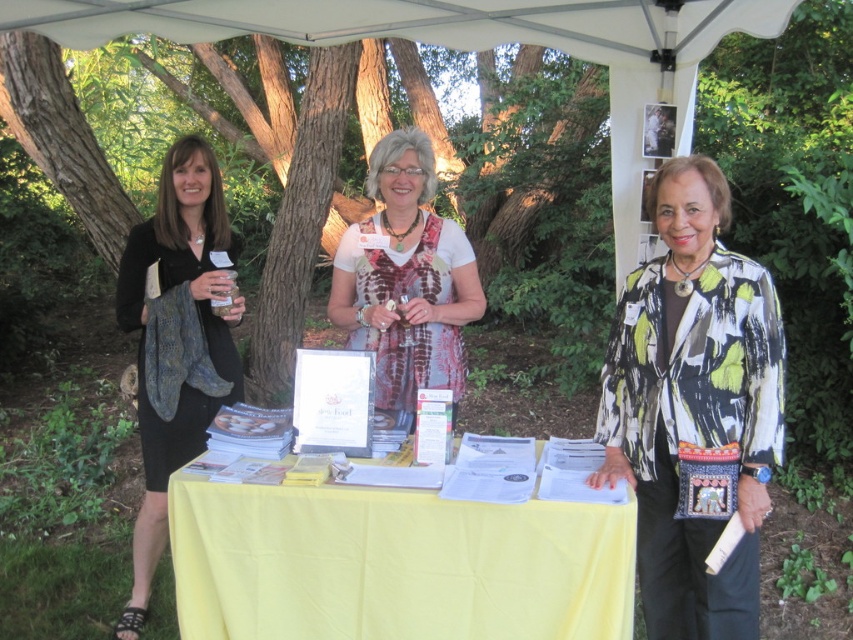
Question: From the image, what is the correct spatial relationship of yellow fabric table at center in relation to printed fabric jacket at center?

Choices:
 (A) above
 (B) below

Answer: (B)

Question: From the image, what is the correct spatial relationship of yellow fabric table at center in relation to white printed scarf at center?

Choices:
 (A) left
 (B) right

Answer: (B)

Question: Based on their relative distances, which object is farther from the yellow fabric table at center?

Choices:
 (A) printed fabric jacket at center
 (B) black matte scarf at left

Answer: (B)

Question: Which point appears closest to the camera in this image?

Choices:
 (A) (363, 225)
 (B) (680, 593)
 (C) (616, 560)
 (D) (178, 292)

Answer: (C)

Question: Estimate the real-world distances between objects in this image. Which object is closer to the yellow fabric table at center?

Choices:
 (A) printed fabric jacket at center
 (B) white printed scarf at center

Answer: (A)

Question: Does yellow fabric table at center have a greater width compared to printed fabric jacket at center?

Choices:
 (A) yes
 (B) no

Answer: (A)